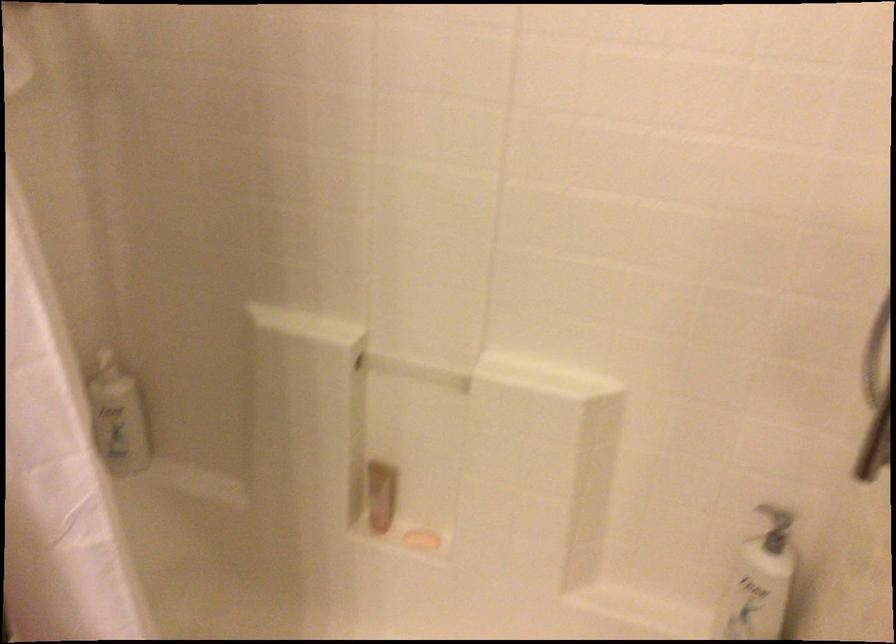
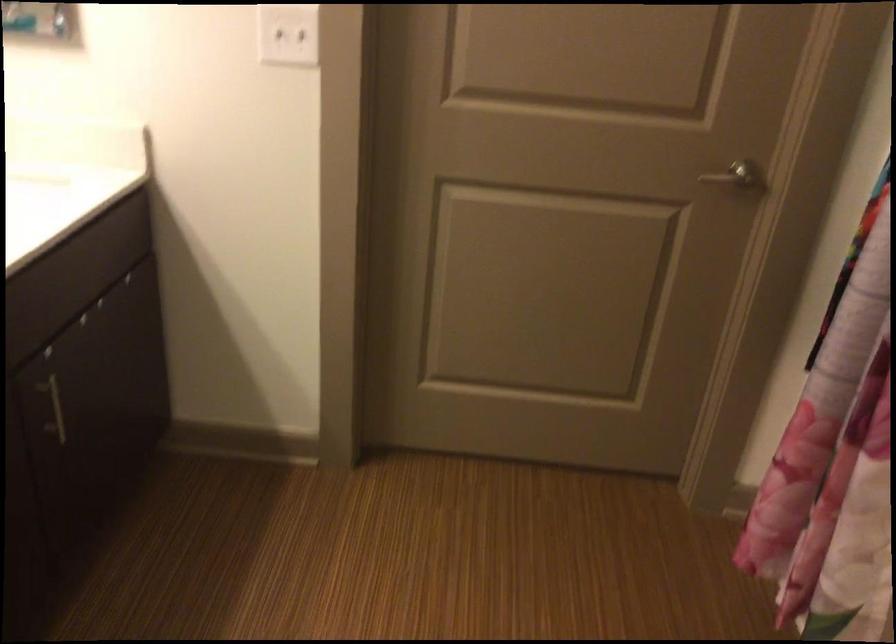
Question: The first image is from the beginning of the video and the second image is from the end. How did the camera likely rotate when shooting the video?

Choices:
 (A) Left
 (B) Right
 (C) Up
 (D) Down

Answer: (A)